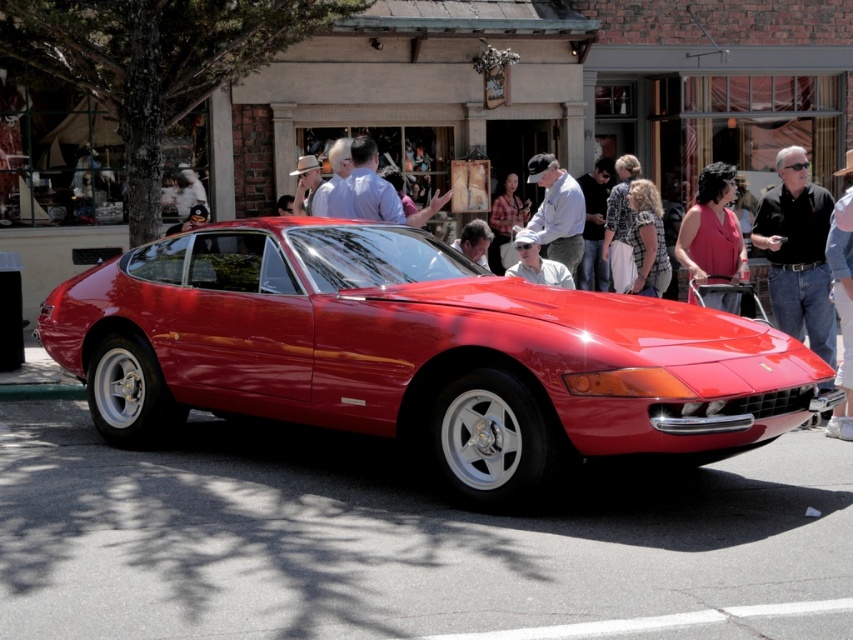
You are a photographer trying to capture a closeup of the matte gray shirt at center and the matte beige hat at center worn by a person in the crowd near the storefront. Since you want both items to be clearly visible in the photo, which item should you focus on to ensure it appears in sharp detail?

You should focus on the matte gray shirt at center because it has a larger size compared to the matte beige hat at center, making it easier to capture sharp details.

You are a photographer trying to capture both the shiny red car at center and the black shirt at center in a single frame. Which object should you focus on first to ensure both are in the frame without moving the camera?

Since the shiny red car at center is larger in size than the black shirt at center, you should focus on the shiny red car at center first as it takes up more space in the frame, ensuring the smaller black shirt at center will also be included.

You are a photographer trying to capture a full view of the shiny red car at center without any obstructions. There is a person wearing a black shirt at center standing near the car. Based on their sizes, do you think you can fit the entire car in the frame while keeping the person in the shot?

The shiny red car at center might be wider than black shirt at center, so there is a possibility that the entire car can be captured in the frame while including the person in the shot, as the car is likely wider and the person may not fully block it.